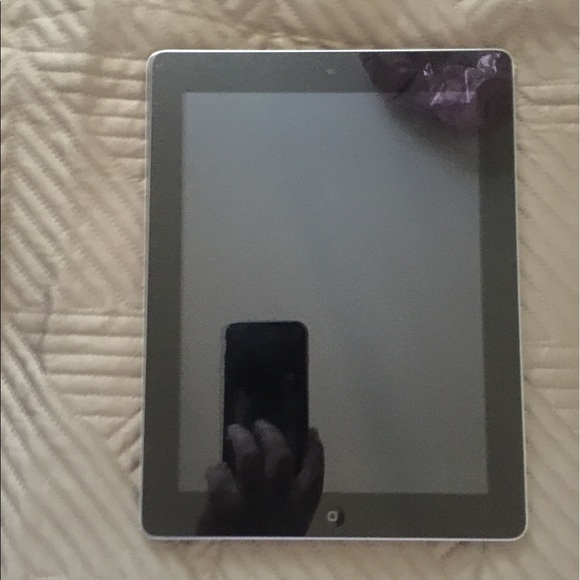
You are a GUI agent. You are given a task and a screenshot of the screen. Output one action in this format:
    pyautogui.click(x=<x>, y=<y>)
    Task: Click on the mattress
    
    Given the screenshot: What is the action you would take?
    pyautogui.click(x=115, y=256)